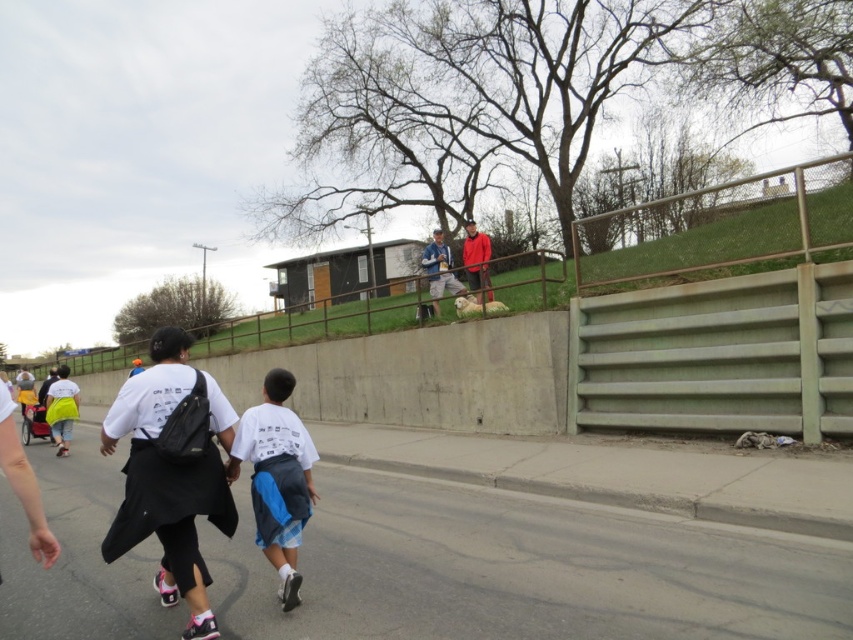
Question: Estimate the real-world distances between objects in this image. Which object is farther from the white cotton shirt at center?

Choices:
 (A) matte blue shirt at center
 (B) matte red jacket at upper center

Answer: (B)

Question: Is matte blue shirt at center bigger than matte red jacket at upper center?

Choices:
 (A) no
 (B) yes

Answer: (A)

Question: Is white cotton shirt at center to the left of matte blue shirt at center from the viewer's perspective?

Choices:
 (A) no
 (B) yes

Answer: (B)

Question: Which of the following is the closest to the observer?

Choices:
 (A) white cotton shirt at center
 (B) matte red jacket at upper center

Answer: (A)

Question: Estimate the real-world distances between objects in this image. Which object is farther from the white cotton shirt at center?

Choices:
 (A) matte red jacket at upper center
 (B) matte blue shirt at center

Answer: (A)

Question: Is white cotton shirt at center in front of matte red jacket at upper center?

Choices:
 (A) no
 (B) yes

Answer: (B)